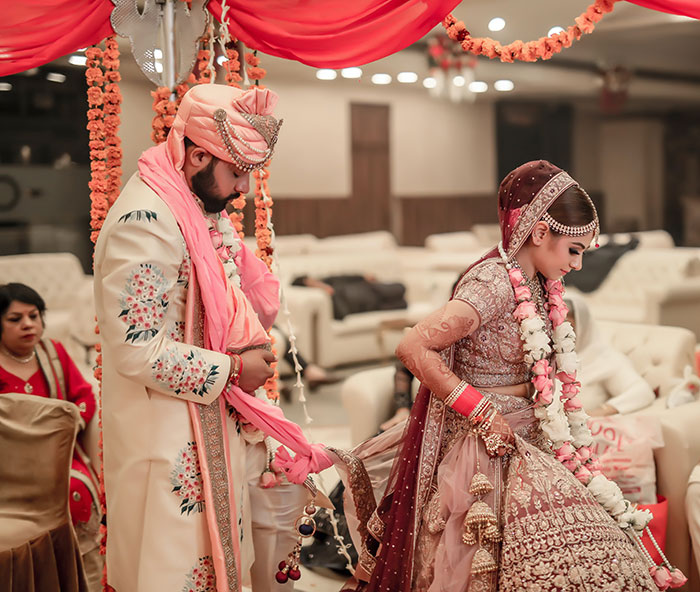
Where is `sofa`? The width and height of the screenshot is (700, 592). sofa is located at coordinates (662, 267), (47, 268), (374, 240).